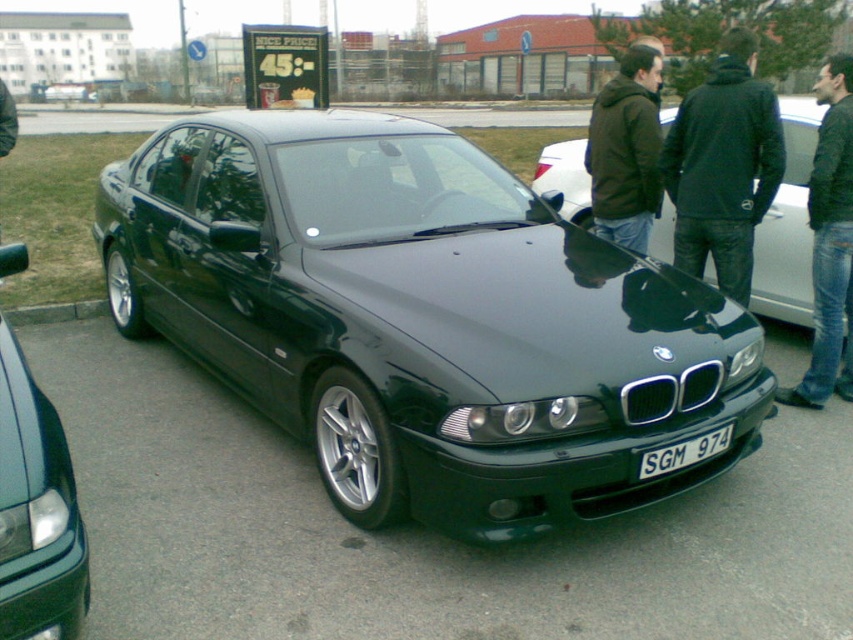
Question: Can you confirm if green metallic car at left is wider than dark green leather jacket at center?

Choices:
 (A) yes
 (B) no

Answer: (B)

Question: Among these objects, which one is farthest from the camera?

Choices:
 (A) metallic dark green car at center
 (B) green metallic car at left
 (C) white plastic license plate at center

Answer: (C)

Question: Which point is farther from the camera taking this photo?

Choices:
 (A) [653, 476]
 (B) [486, 214]
 (C) [645, 72]
 (D) [799, 188]

Answer: (D)

Question: Is dark green metallic car at center positioned before gray concrete curb at lower left?

Choices:
 (A) no
 (B) yes

Answer: (B)

Question: Which object is positioned farthest from the jeans at right?

Choices:
 (A) dark green jacket at upper right
 (B) gray concrete curb at lower left
 (C) dark green leather jacket at center

Answer: (B)

Question: Can you confirm if jeans at right is wider than gray concrete curb at lower left?

Choices:
 (A) yes
 (B) no

Answer: (A)